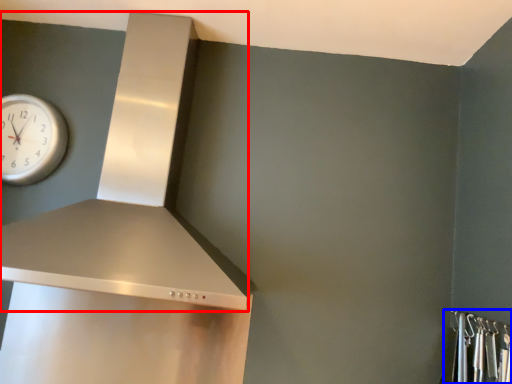
Question: Which object appears closest to the camera in this image, vent (highlighted by a red box) or closet (highlighted by a blue box)?

Choices:
 (A) vent
 (B) closet

Answer: (B)